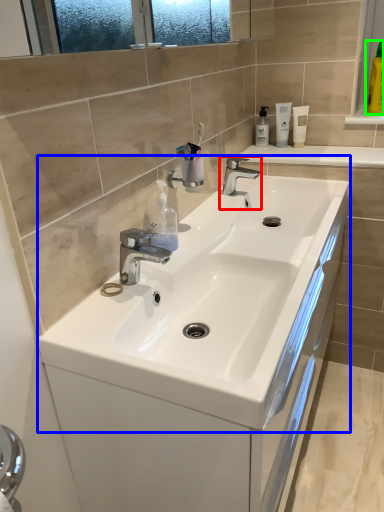
Question: Estimate the real-world distances between objects in this image. Which object is closer to tap (highlighted by a red box), sink (highlighted by a blue box) or mouthwash (highlighted by a green box)?

Choices:
 (A) sink
 (B) mouthwash

Answer: (A)